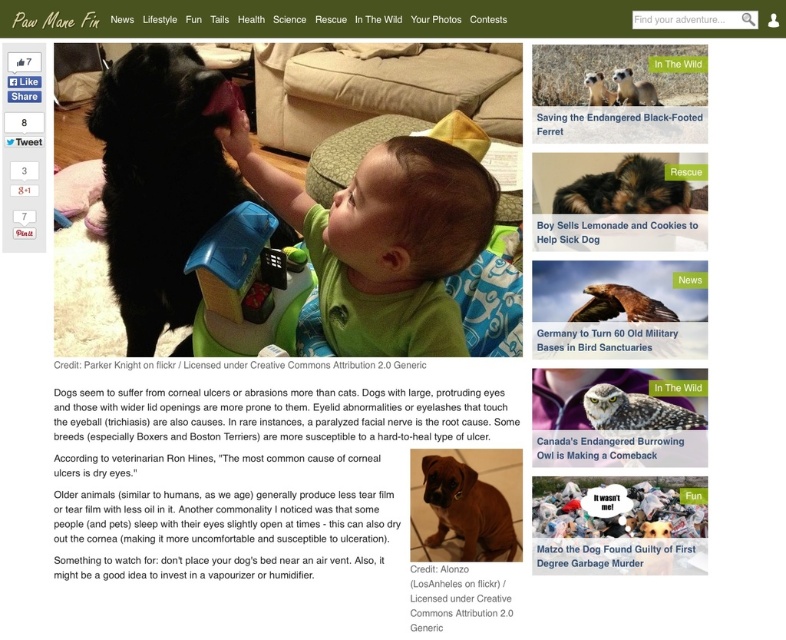
Which is behind, point (322, 298) or point (594, 317)?

The point (322, 298) is more distant.

Can you confirm if green fabric baby at center is positioned above golden brown feathers at center?

Yes, green fabric baby at center is above golden brown feathers at center.

Does point (412, 256) lie in front of point (603, 307)?

No, it is behind (603, 307).

Image resolution: width=786 pixels, height=640 pixels. In order to click on green fabric baby at center in this screenshot , I will do `click(384, 241)`.

Does soft brown fur at center appear under furry black ferret at upper center?

Yes.

Who is more distant from viewer, (615, 189) or (612, 93)?

The point (615, 189) is behind.

At what (x,y) coordinates should I click in order to perform the action: click on soft brown fur at center. Please return your answer as a coordinate pair (x, y). The width and height of the screenshot is (786, 640). Looking at the image, I should click on (623, 189).

I want to click on soft brown fur at center, so click(623, 189).

Looking at this image, does brown matte hair at center appear over golden brown feathers at center?

Correct, brown matte hair at center is located above golden brown feathers at center.

The image size is (786, 640). What do you see at coordinates (439, 204) in the screenshot? I see `brown matte hair at center` at bounding box center [439, 204].

The width and height of the screenshot is (786, 640). Find the location of `brown matte hair at center`. brown matte hair at center is located at coordinates (439, 204).